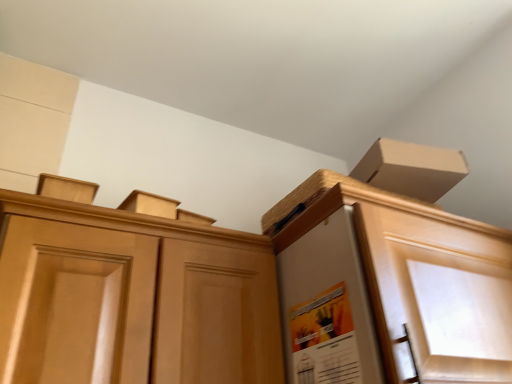
Question: From a real-world perspective, is light brown wood cabinet at center positioned under matte orange poster at center based on gravity?

Choices:
 (A) no
 (B) yes

Answer: (A)

Question: Considering the relative sizes of light brown wood cabinet at center and matte orange poster at center in the image provided, is light brown wood cabinet at center shorter than matte orange poster at center?

Choices:
 (A) no
 (B) yes

Answer: (A)

Question: Does light brown wood cabinet at center lie behind matte orange poster at center?

Choices:
 (A) yes
 (B) no

Answer: (B)

Question: Does light brown wood cabinet at center have a greater width compared to matte orange poster at center?

Choices:
 (A) yes
 (B) no

Answer: (A)

Question: From a real-world perspective, is light brown wood cabinet at center located higher than matte orange poster at center?

Choices:
 (A) yes
 (B) no

Answer: (A)

Question: Could matte orange poster at center be considered to be inside light brown wood cabinet at center?

Choices:
 (A) no
 (B) yes

Answer: (A)

Question: Is matte orange poster at center facing towards light brown wood cabinet at center?

Choices:
 (A) yes
 (B) no

Answer: (B)

Question: Is matte orange poster at center smaller than light brown wood cabinet at center?

Choices:
 (A) yes
 (B) no

Answer: (A)

Question: Is matte orange poster at center outside of light brown wood cabinet at center?

Choices:
 (A) yes
 (B) no

Answer: (A)

Question: Does matte orange poster at center have a greater width compared to light brown wood cabinet at center?

Choices:
 (A) yes
 (B) no

Answer: (B)

Question: Is matte orange poster at center at the left side of light brown wood cabinet at center?

Choices:
 (A) no
 (B) yes

Answer: (A)

Question: Considering the relative sizes of matte orange poster at center and light brown wood cabinet at center in the image provided, is matte orange poster at center thinner than light brown wood cabinet at center?

Choices:
 (A) yes
 (B) no

Answer: (A)

Question: Is matte orange poster at center inside the boundaries of light brown wood cabinet at center, or outside?

Choices:
 (A) inside
 (B) outside

Answer: (B)